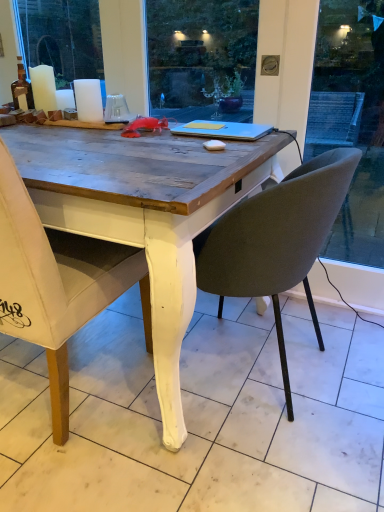
The image size is (384, 512). Identify the location of free point below matte gray chair at center, the second chair from the left (from a real-world perspective). (245, 365).